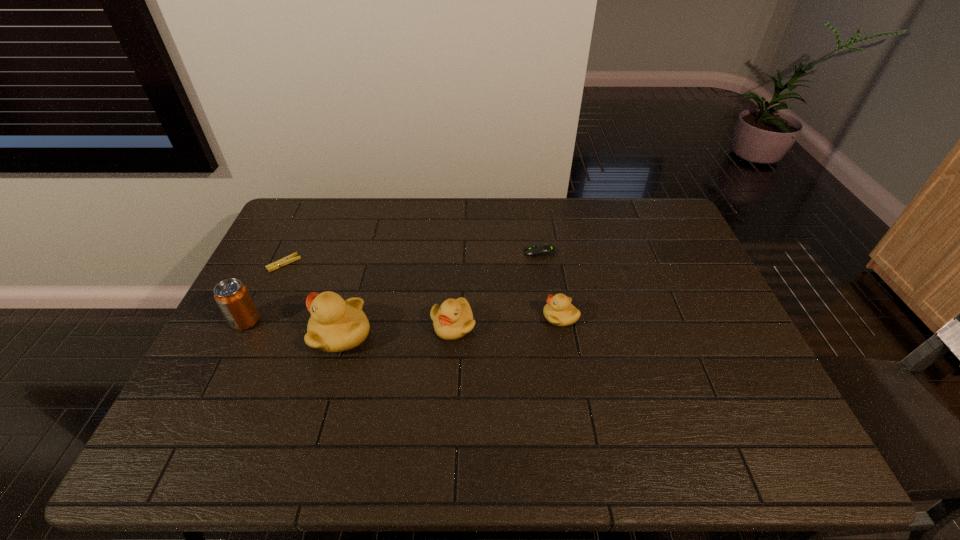
Locate an element on the screen. the leftmost duckling is located at coordinates (335, 325).

Identify the location of the fourth object from right to left. This screenshot has width=960, height=540. (335, 325).

Image resolution: width=960 pixels, height=540 pixels. I want to click on the third tallest object, so click(x=452, y=320).

The height and width of the screenshot is (540, 960). What are the coordinates of `the third object from right to left` in the screenshot? It's located at (452, 320).

Identify the location of the rightmost duckling. (559, 311).

Find the location of a particular element. This screenshot has width=960, height=540. the fourth tallest object is located at coordinates (559, 311).

You are a GUI agent. You are given a task and a screenshot of the screen. Output one action in this format:
    pyautogui.click(x=<x>, y=<y>)
    Task: Click on the clothespin
    This screenshot has width=960, height=540.
    Given the screenshot: What is the action you would take?
    pyautogui.click(x=291, y=258)

Where is `the fifth tallest object`? the fifth tallest object is located at coordinates (537, 250).

Find the location of a particular element. The width and height of the screenshot is (960, 540). soda can is located at coordinates (232, 297).

Identify the location of blank space located on the beak of the leftmost duckling. This screenshot has height=540, width=960. (248, 334).